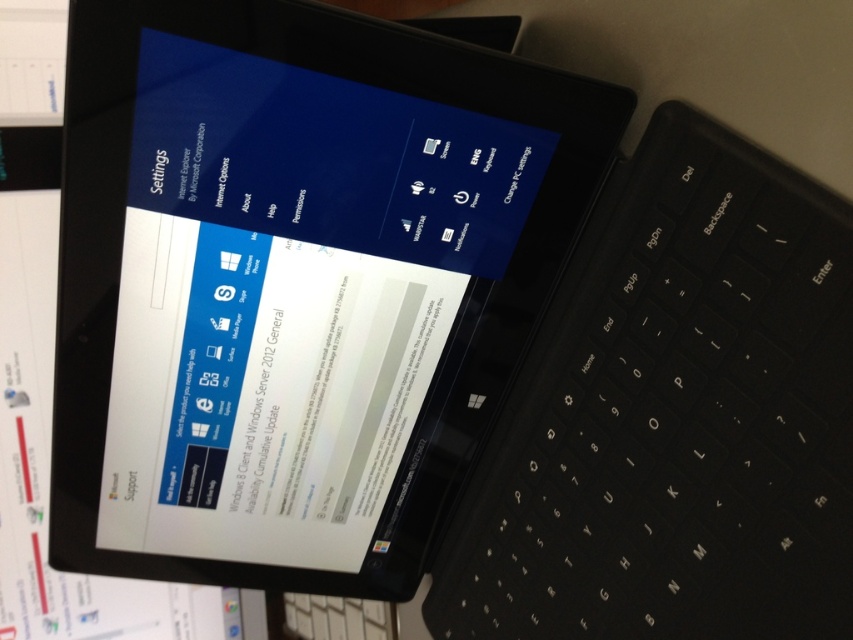
Question: Can you confirm if black glossy tablet at center is smaller than black plastic keyboard at center?

Choices:
 (A) yes
 (B) no

Answer: (B)

Question: Where is black glossy tablet at center located in relation to black plastic keyboard at center in the image?

Choices:
 (A) below
 (B) above

Answer: (B)

Question: Which of the following is the farthest from the observer?

Choices:
 (A) black plastic keyboard at center
 (B) black glossy tablet at center

Answer: (B)

Question: Is black glossy tablet at center to the right of black plastic keyboard at center from the viewer's perspective?

Choices:
 (A) no
 (B) yes

Answer: (A)

Question: Among these objects, which one is nearest to the camera?

Choices:
 (A) black glossy tablet at center
 (B) black plastic keyboard at center

Answer: (B)

Question: Which of the following is the farthest from the observer?

Choices:
 (A) black glossy tablet at center
 (B) black plastic keyboard at center

Answer: (A)